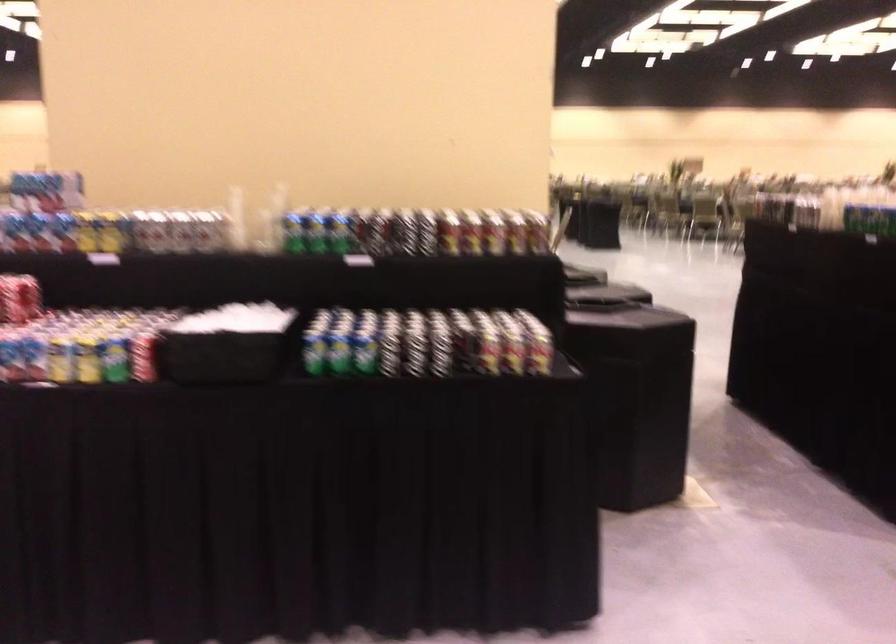
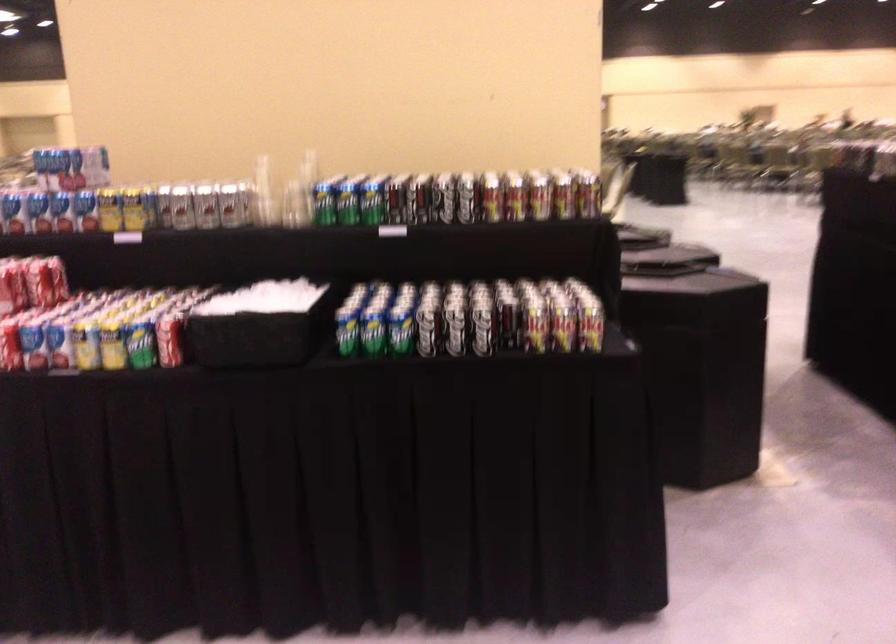
What movement of the cameraman would produce the second image?

The cameraman walked toward right, forward.